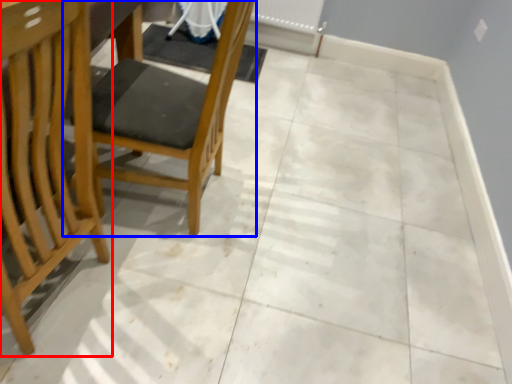
Question: Which object is further to the camera taking this photo, chair (highlighted by a red box) or chair (highlighted by a blue box)?

Choices:
 (A) chair
 (B) chair

Answer: (B)